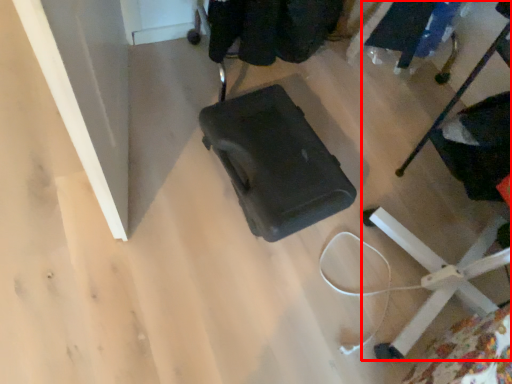
Question: From the image's perspective, where is furniture (annotated by the red box) located in relation to baby carriage in the image?

Choices:
 (A) below
 (B) above

Answer: (A)